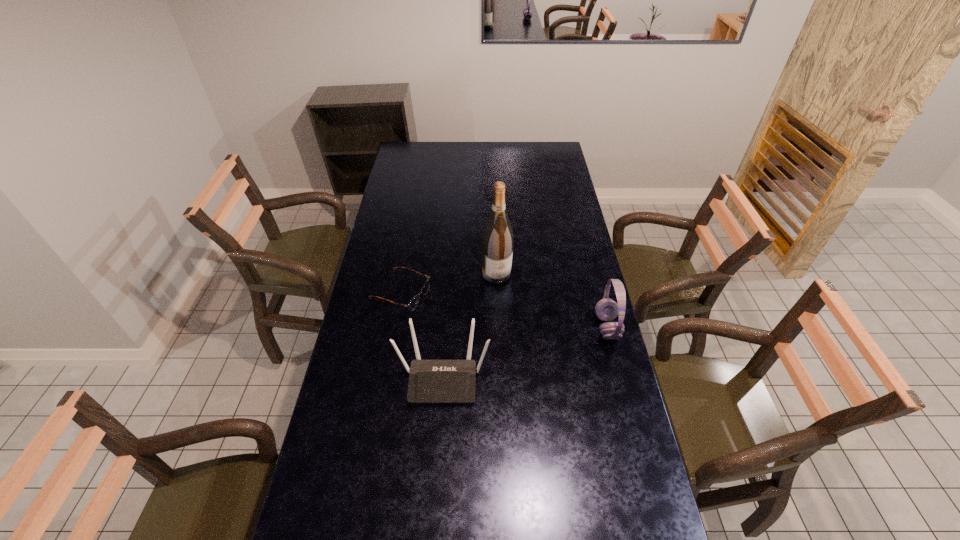
The height and width of the screenshot is (540, 960). Find the location of `free space between the nearest object and the wine bottle`. free space between the nearest object and the wine bottle is located at coordinates (469, 325).

At what (x,y) coordinates should I click in order to perform the action: click on vacant area that lies between the spectacles and the wine bottle. Please return your answer as a coordinate pair (x, y). The height and width of the screenshot is (540, 960). Looking at the image, I should click on (449, 284).

This screenshot has height=540, width=960. In order to click on object identified as the closest to the tallest object in this screenshot , I will do `click(413, 303)`.

The height and width of the screenshot is (540, 960). I want to click on the second closest object to the shortest object, so click(x=497, y=240).

Identify the location of free spot that satisfies the following two spatial constraints: 1. on the front side of the headset; 2. on the headband and ear cups of the tallest object. click(x=498, y=327).

I want to click on free space in the image that satisfies the following two spatial constraints: 1. on the front side of the tallest object; 2. on the headband and ear cups of the headset, so click(498, 327).

This screenshot has width=960, height=540. Find the location of `vacant point that satisfies the following two spatial constraints: 1. on the front side of the wine bottle; 2. on the headband and ear cups of the rightmost object`. vacant point that satisfies the following two spatial constraints: 1. on the front side of the wine bottle; 2. on the headband and ear cups of the rightmost object is located at coordinates (498, 327).